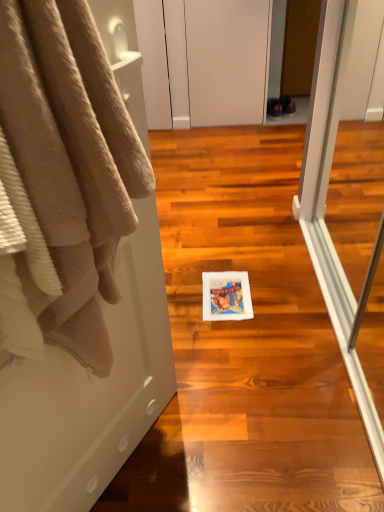
This screenshot has width=384, height=512. Identify the location of vacant region under beige plush towel at left (from a real-world perspective). (155, 473).